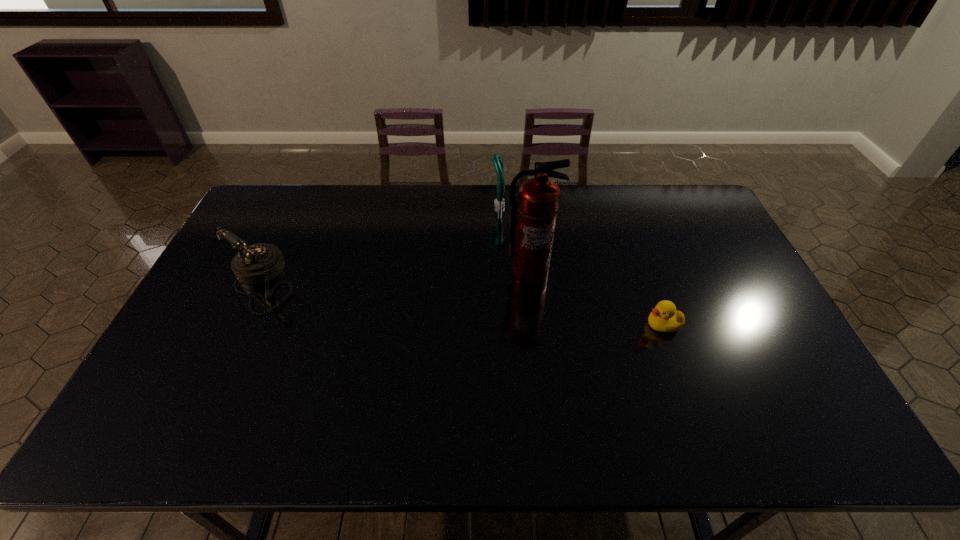
Find the location of a particular element. vacant space located at the jaws of the farthest object is located at coordinates (427, 205).

Find the location of `vacant area situated on the back of the third tallest object`. vacant area situated on the back of the third tallest object is located at coordinates (300, 201).

You are a GUI agent. You are given a task and a screenshot of the screen. Output one action in this format:
    pyautogui.click(x=<x>, y=<y>)
    Task: Click on the free space located 0.280m at the beak of the shortest object
    This screenshot has height=540, width=960.
    Given the screenshot: What is the action you would take?
    pyautogui.click(x=544, y=325)

I want to click on blank space located 0.400m at the beak of the shortest object, so click(x=501, y=325).

Image resolution: width=960 pixels, height=540 pixels. In order to click on vacant space situated 0.390m at the beak of the shortest object in this screenshot , I will do `click(505, 325)`.

The width and height of the screenshot is (960, 540). I want to click on object located at the far edge, so click(497, 160).

This screenshot has width=960, height=540. Find the location of `object present at the left edge`. object present at the left edge is located at coordinates (258, 263).

The image size is (960, 540). I want to click on vacant space at the far edge of the desktop, so click(x=428, y=198).

This screenshot has width=960, height=540. I want to click on free region at the near edge of the desktop, so click(238, 428).

In the image, there is a desktop. At what (x,y) coordinates should I click in order to perform the action: click on vacant space at the left edge. Please return your answer as a coordinate pair (x, y). The width and height of the screenshot is (960, 540). Looking at the image, I should click on (205, 305).